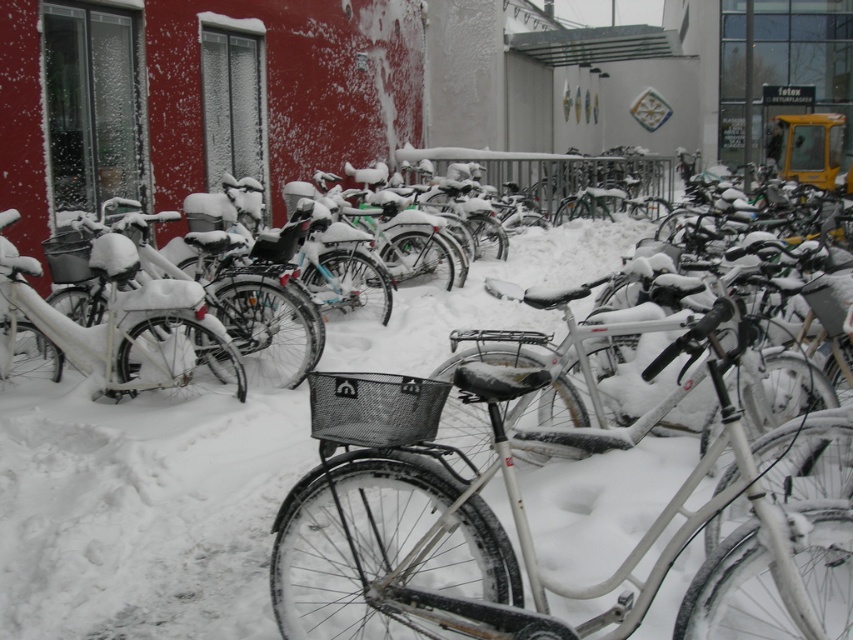
Question: Is white matte bicycle at center further to camera compared to white matte bicycle at left?

Choices:
 (A) no
 (B) yes

Answer: (A)

Question: Which of the following is the farthest from the observer?

Choices:
 (A) white matte bicycle at left
 (B) white matte bicycle at center

Answer: (A)

Question: Can you confirm if white matte bicycle at center is positioned above white matte bicycle at left?

Choices:
 (A) no
 (B) yes

Answer: (A)

Question: Does white matte bicycle at center have a lesser width compared to white matte bicycle at left?

Choices:
 (A) yes
 (B) no

Answer: (B)